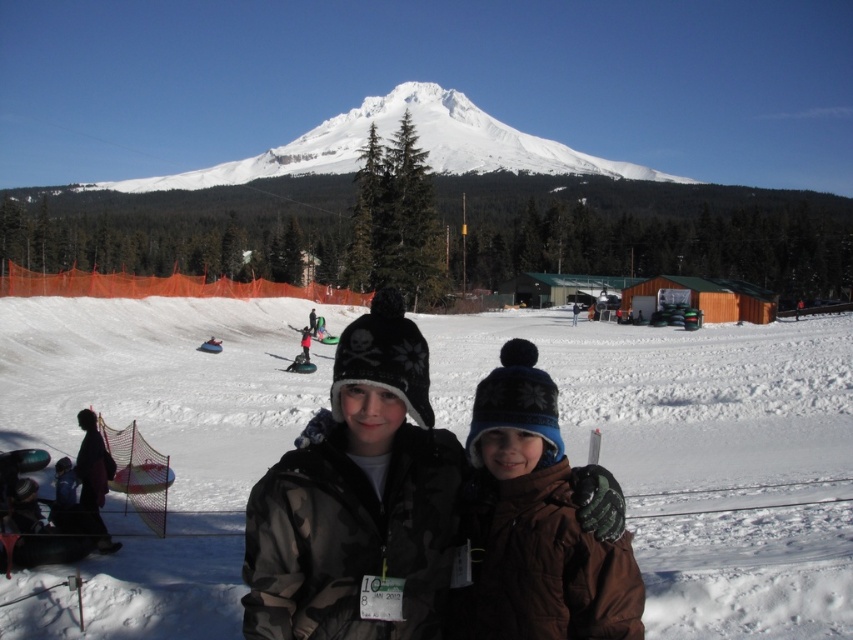
Question: Does brown fuzzy jacket at center appear over white snow-covered mountain at upper center?

Choices:
 (A) no
 (B) yes

Answer: (A)

Question: Does brown fuzzy jacket at center appear on the right side of white snow-covered mountain at upper center?

Choices:
 (A) yes
 (B) no

Answer: (A)

Question: Which of the following is the closest to the observer?

Choices:
 (A) white snow-covered mountain at upper center
 (B) white fluffy snow at center
 (C) green plastic ski at center

Answer: (B)

Question: Which object is positioned farthest from the green plastic ski at center?

Choices:
 (A) brown fuzzy jacket at center
 (B) white snow-covered mountain at upper center
 (C) white fluffy snow at center
 (D) camouflage jacket at center

Answer: (B)

Question: Which point is farther to the camera?

Choices:
 (A) (328, 339)
 (B) (306, 540)
 (C) (529, 561)

Answer: (A)

Question: Is white fluffy snow at center positioned before green plastic ski at center?

Choices:
 (A) no
 (B) yes

Answer: (B)